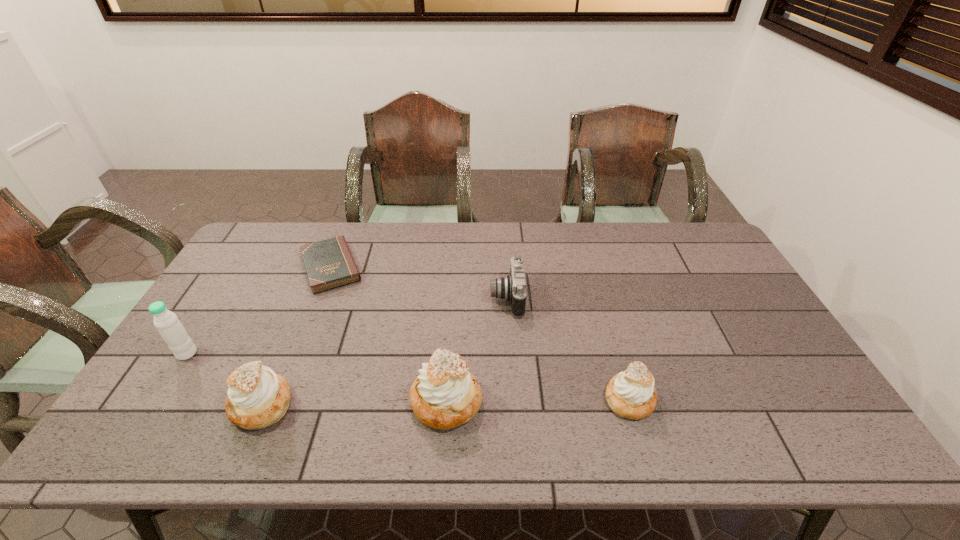
With all pastrys evenly spaced, where should an extra pastry be placed on the right to continue the pattern? Please point out a vacant space. Please provide its 2D coordinates. Your answer should be formatted as a tuple, i.e. [(x, y)], where the tuple contains the x and y coordinates of a point satisfying the conditions above.

[(810, 396)]